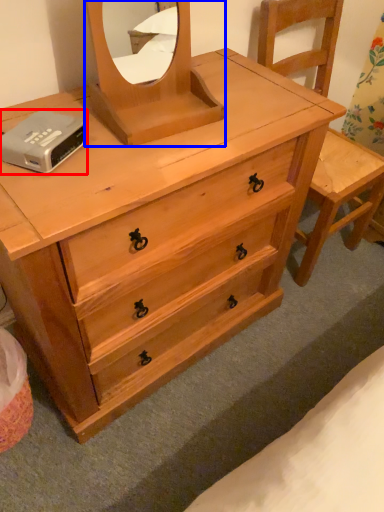
Question: Which object appears farthest to the camera in this image, hardware (highlighted by a red box) or mirror (highlighted by a blue box)?

Choices:
 (A) hardware
 (B) mirror

Answer: (A)